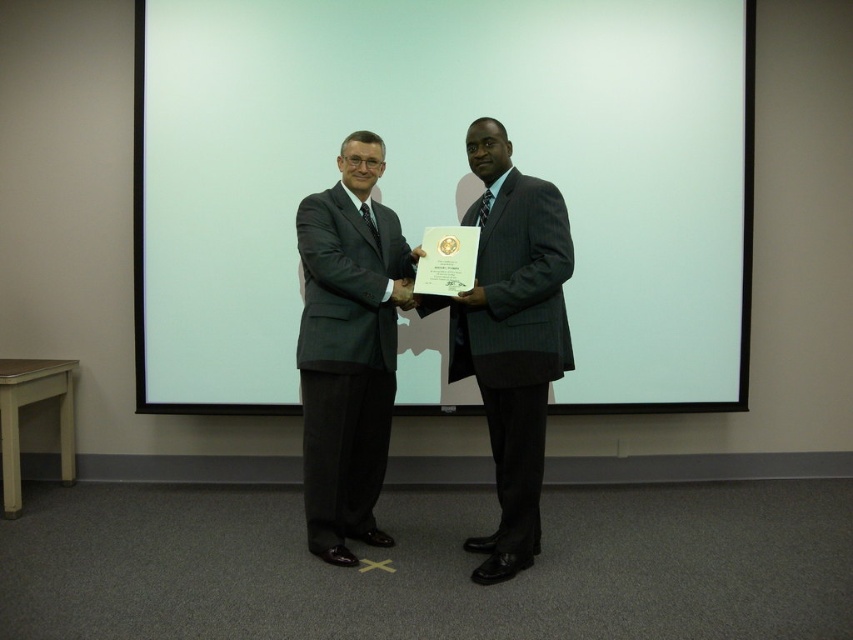
Question: Can you confirm if white matte screen at center is positioned to the right of matte black suit at center?

Choices:
 (A) no
 (B) yes

Answer: (B)

Question: Which of the following is the closest to the observer?

Choices:
 (A) (553, 275)
 (B) (326, 422)

Answer: (A)

Question: Does white matte screen at center have a greater width compared to matte black suit at center?

Choices:
 (A) yes
 (B) no

Answer: (A)

Question: Which point is farther to the camera?

Choices:
 (A) 543,296
 (B) 341,284
 (C) 374,29

Answer: (C)

Question: Where is matte black suit at center located in relation to gray pinstripe suit at center in the image?

Choices:
 (A) below
 (B) above

Answer: (A)

Question: Which point is closer to the camera?

Choices:
 (A) gray pinstripe suit at center
 (B) matte black suit at center
 (C) white matte screen at center

Answer: (A)